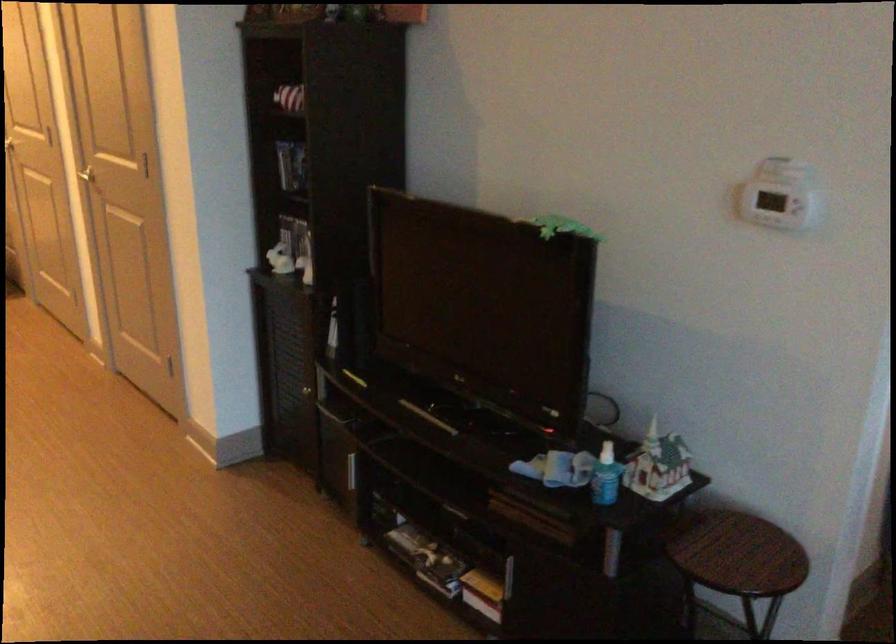
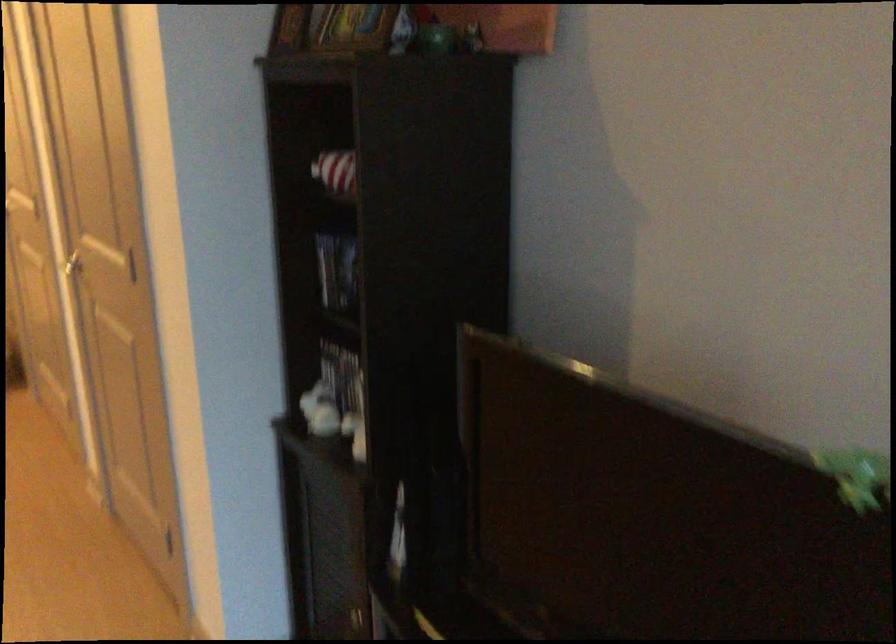
Question: In a continuous first-person perspective shot, in which direction is the camera moving?

Choices:
 (A) Left
 (B) Right
 (C) Forward
 (D) Backward

Answer: (C)